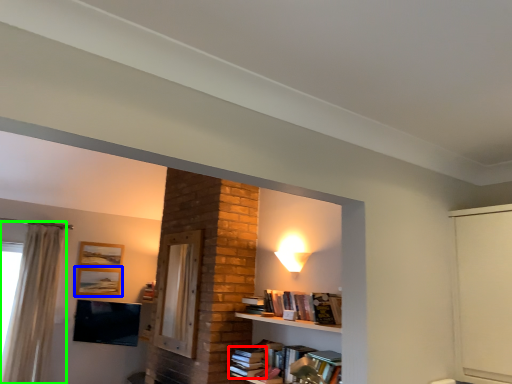
Question: Which is farther away from book (highlighted by a red box)? picture frame (highlighted by a blue box) or curtain (highlighted by a green box)?

Choices:
 (A) picture frame
 (B) curtain

Answer: (A)